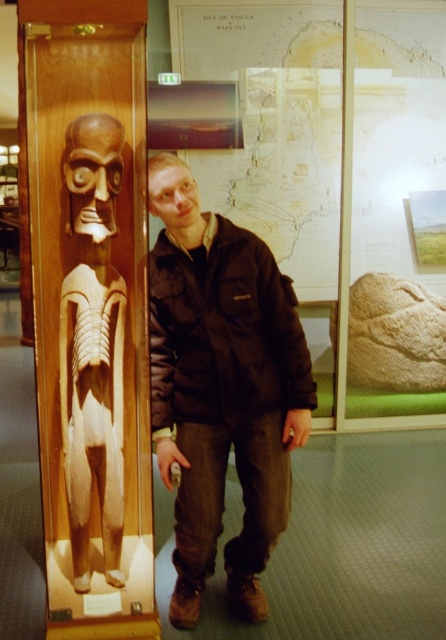
Is brown fabric jacket at center wider than wooden carving at left?

Yes, brown fabric jacket at center is wider than wooden carving at left.

Is brown fabric jacket at center positioned behind wooden carving at left?

Yes, it is.

What do you see at coordinates (222, 387) in the screenshot? Image resolution: width=446 pixels, height=640 pixels. I see `brown fabric jacket at center` at bounding box center [222, 387].

This screenshot has height=640, width=446. Identify the location of brown fabric jacket at center. (222, 387).